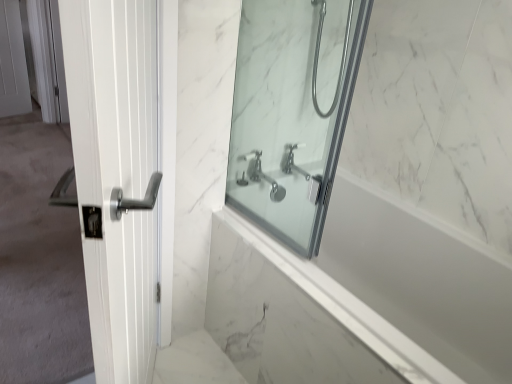
Question: Considering the relative sizes of satin nickel showerhead at upper center and white glossy door handle at left in the image provided, is satin nickel showerhead at upper center shorter than white glossy door handle at left?

Choices:
 (A) yes
 (B) no

Answer: (A)

Question: Considering the relative sizes of satin nickel showerhead at upper center and white glossy door handle at left in the image provided, is satin nickel showerhead at upper center wider than white glossy door handle at left?

Choices:
 (A) yes
 (B) no

Answer: (B)

Question: Does satin nickel showerhead at upper center appear on the right side of white glossy door handle at left?

Choices:
 (A) no
 (B) yes

Answer: (B)

Question: From the image's perspective, is satin nickel showerhead at upper center above white glossy door handle at left?

Choices:
 (A) no
 (B) yes

Answer: (B)

Question: From a real-world perspective, is satin nickel showerhead at upper center physically above white glossy door handle at left?

Choices:
 (A) no
 (B) yes

Answer: (B)

Question: Is white marble bathtub at center situated inside chrome metallic faucet at center or outside?

Choices:
 (A) inside
 (B) outside

Answer: (B)

Question: From a real-world perspective, relative to chrome metallic faucet at center, is white marble bathtub at center vertically above or below?

Choices:
 (A) below
 (B) above

Answer: (A)

Question: Relative to chrome metallic faucet at center, is white marble bathtub at center in front or behind?

Choices:
 (A) front
 (B) behind

Answer: (A)

Question: In terms of height, does white marble bathtub at center look taller or shorter compared to chrome metallic faucet at center?

Choices:
 (A) tall
 (B) short

Answer: (A)

Question: From the image's perspective, is chrome metallic faucet at center positioned above or below satin nickel showerhead at upper center?

Choices:
 (A) below
 (B) above

Answer: (A)

Question: Is chrome metallic faucet at center in front of or behind satin nickel showerhead at upper center in the image?

Choices:
 (A) behind
 (B) front

Answer: (A)

Question: Considering the relative positions of chrome metallic faucet at center and satin nickel showerhead at upper center in the image provided, is chrome metallic faucet at center to the left or to the right of satin nickel showerhead at upper center?

Choices:
 (A) right
 (B) left

Answer: (B)

Question: In terms of size, does chrome metallic faucet at center appear bigger or smaller than satin nickel showerhead at upper center?

Choices:
 (A) big
 (B) small

Answer: (B)

Question: From the image's perspective, relative to white marble bathtub at center, is white glossy door handle at left above or below?

Choices:
 (A) below
 (B) above

Answer: (B)

Question: Which is correct: white glossy door handle at left is inside white marble bathtub at center, or outside of it?

Choices:
 (A) inside
 (B) outside

Answer: (B)